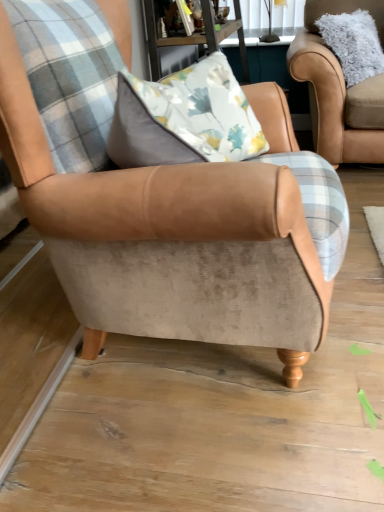
Question: Is wooden table at upper center inside or outside of suede armchair at center, positioned as the second chair in back-to-front order?

Choices:
 (A) outside
 (B) inside

Answer: (A)

Question: Considering the positions of wooden table at upper center and suede armchair at center, the second chair from the top, in the image, is wooden table at upper center wider or thinner than suede armchair at center, the second chair from the top,?

Choices:
 (A) wide
 (B) thin

Answer: (B)

Question: Which of these objects is positioned closest to the suede armchair at center, the first chair in the front-to-back sequence?

Choices:
 (A) wooden table at upper center
 (B) fuzzy beige armchair at upper right, which is counted as the 1th chair, starting from the right

Answer: (A)

Question: Which of these objects is positioned closest to the wooden table at upper center?

Choices:
 (A) suede armchair at center, the first chair in the front-to-back sequence
 (B) fuzzy beige armchair at upper right, the 2th chair in the left-to-right sequence

Answer: (B)